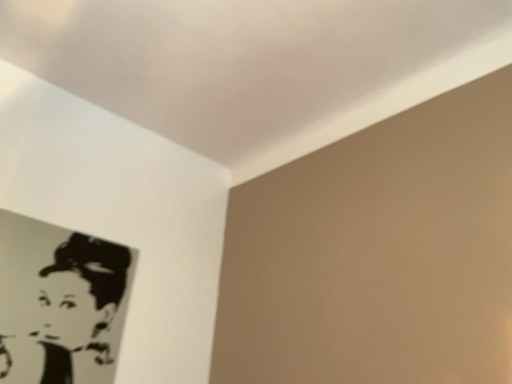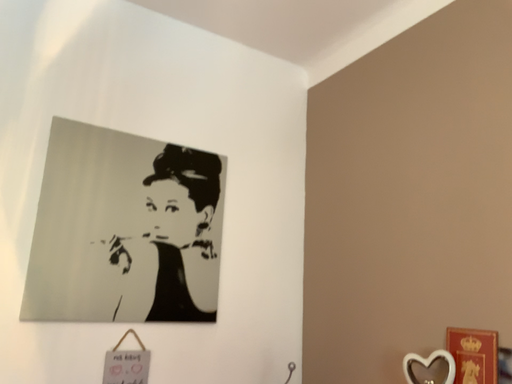
Question: Which way did the camera rotate in the video?

Choices:
 (A) rotated left
 (B) rotated right

Answer: (A)